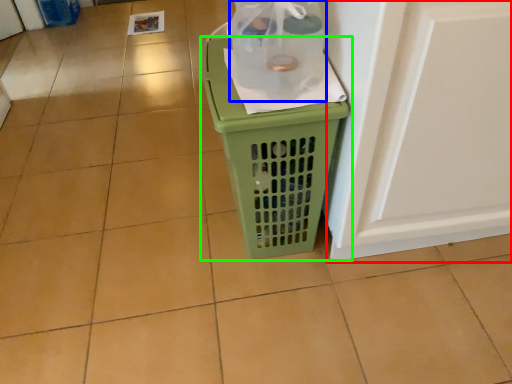
Question: Which is nearer to the screen door (highlighted by a red box)? bottle (highlighted by a blue box) or waste container (highlighted by a green box).

Choices:
 (A) bottle
 (B) waste container

Answer: (B)